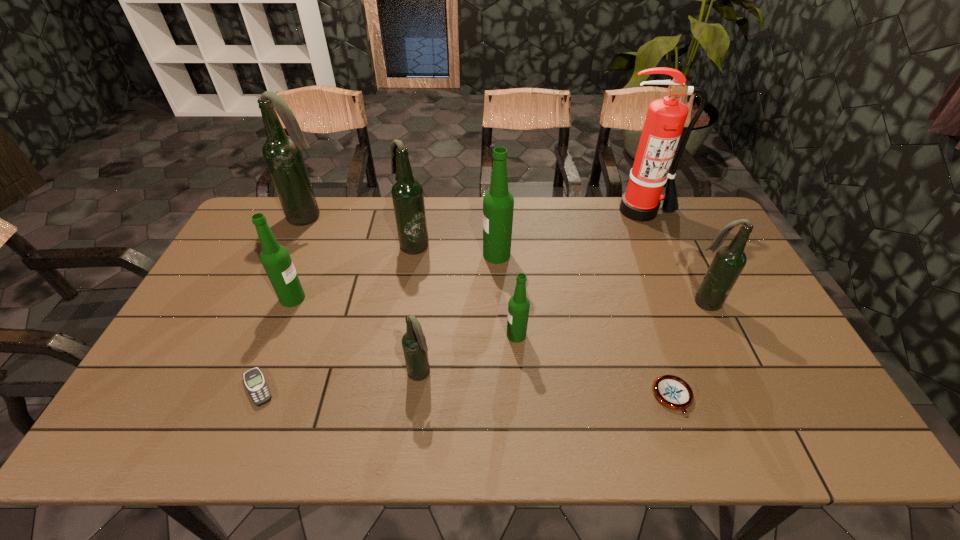
Where is `vacant area that satisfies the following two spatial constraints: 1. on the back side of the third biggest dark beer bottle; 2. on the left side of the smallest dark beer bottle`? The height and width of the screenshot is (540, 960). vacant area that satisfies the following two spatial constraints: 1. on the back side of the third biggest dark beer bottle; 2. on the left side of the smallest dark beer bottle is located at coordinates (428, 302).